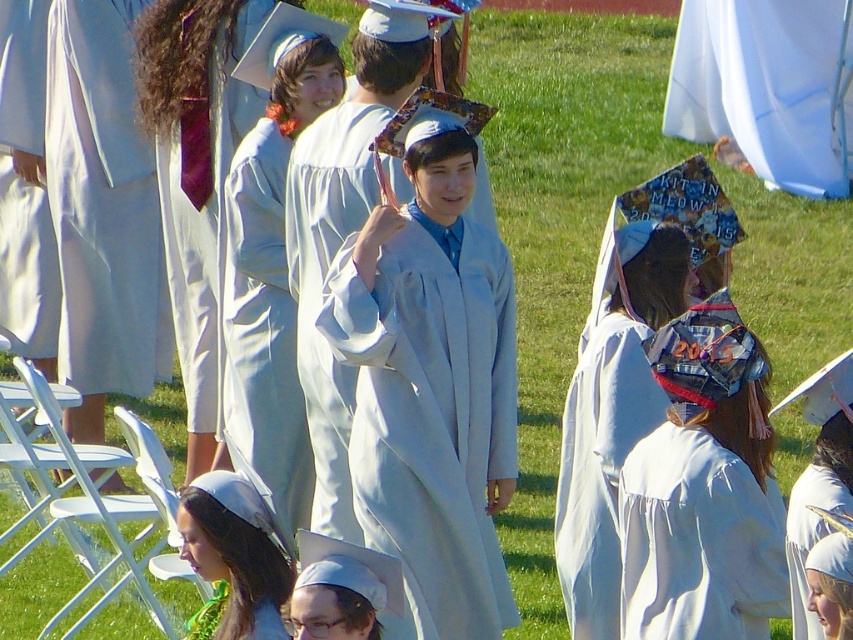
Question: Observing the image, what is the correct spatial positioning of light blue fabric gown at center in reference to denim graduation cap at center?

Choices:
 (A) left
 (B) right

Answer: (A)

Question: Which of the following is the closest to the observer?

Choices:
 (A) white matte graduation gown at center
 (B) white satin graduation cap at lower left
 (C) denim graduation cap at center

Answer: (C)

Question: Which point is farther from the camera taking this photo?

Choices:
 (A) (273, 132)
 (B) (6, 40)
 (C) (212, 573)
 (D) (131, 252)

Answer: (B)

Question: Where is matte white gown at center located in relation to white matte graduation gown at center in the image?

Choices:
 (A) above
 (B) below

Answer: (A)

Question: Can you confirm if white matte gown at left is positioned below white matte graduation cap at lower center?

Choices:
 (A) yes
 (B) no

Answer: (B)

Question: Estimate the real-world distances between objects in this image. Which object is farther from the light blue fabric gown at center?

Choices:
 (A) white matte graduation cap at lower center
 (B) matte white gown at center
 (C) white satin graduation cap at lower left

Answer: (A)